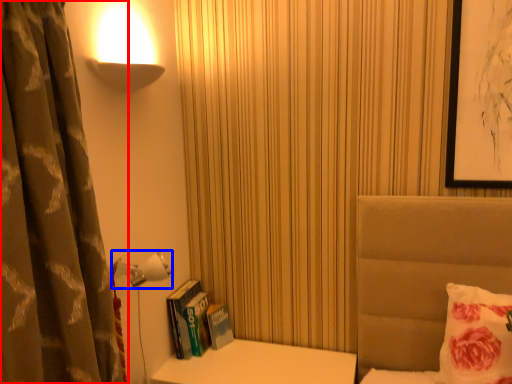
Question: Which object appears closest to the camera in this image, curtain (highlighted by a red box) or lamp (highlighted by a blue box)?

Choices:
 (A) curtain
 (B) lamp

Answer: (A)